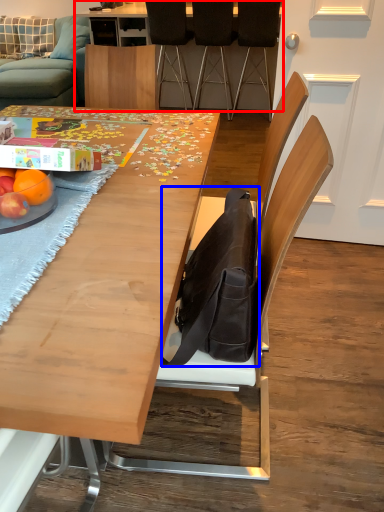
Question: Which of the following is the farthest to the observer, table (highlighted by a red box) or messenger bag (highlighted by a blue box)?

Choices:
 (A) table
 (B) messenger bag

Answer: (A)